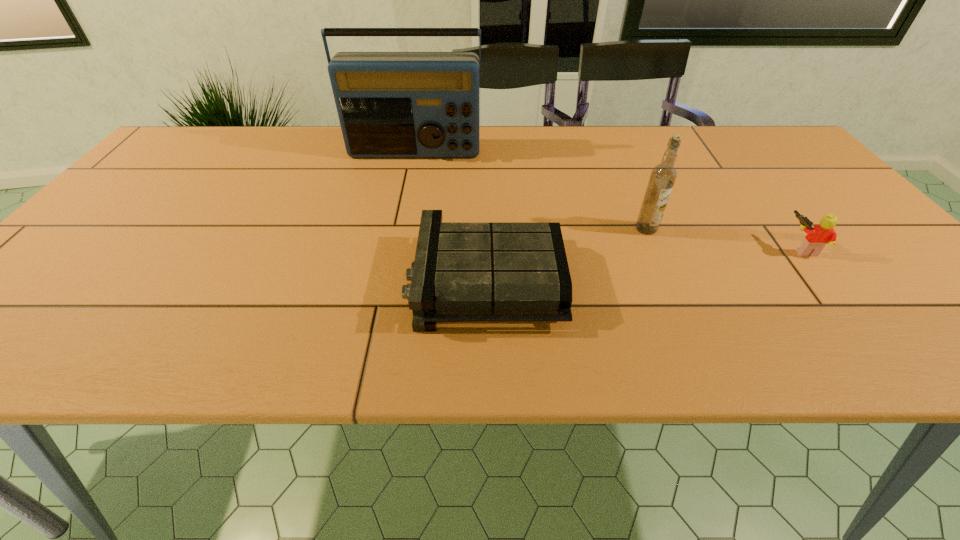
I want to click on the farther radio receiver, so click(x=390, y=104).

This screenshot has width=960, height=540. What are the coordinates of `the farthest object` in the screenshot? It's located at (390, 104).

In order to click on the third nearest object in this screenshot , I will do `click(663, 176)`.

At what (x,y) coordinates should I click in order to perform the action: click on vodka. Please return your answer as a coordinate pair (x, y). Looking at the image, I should click on (663, 176).

What are the coordinates of `the second shortest object` in the screenshot? It's located at (819, 235).

Locate an element on the screen. The image size is (960, 540). the rightmost object is located at coordinates (819, 235).

The width and height of the screenshot is (960, 540). In order to click on the shorter radio receiver in this screenshot , I will do `click(463, 272)`.

The width and height of the screenshot is (960, 540). Find the location of `the nearer radio receiver`. the nearer radio receiver is located at coordinates 463,272.

Identify the location of vacant position located 0.400m on the front panel of the farthest object. The height and width of the screenshot is (540, 960). (393, 261).

What are the coordinates of `vacant space located 0.130m on the label of the second farthest object` in the screenshot? It's located at (666, 276).